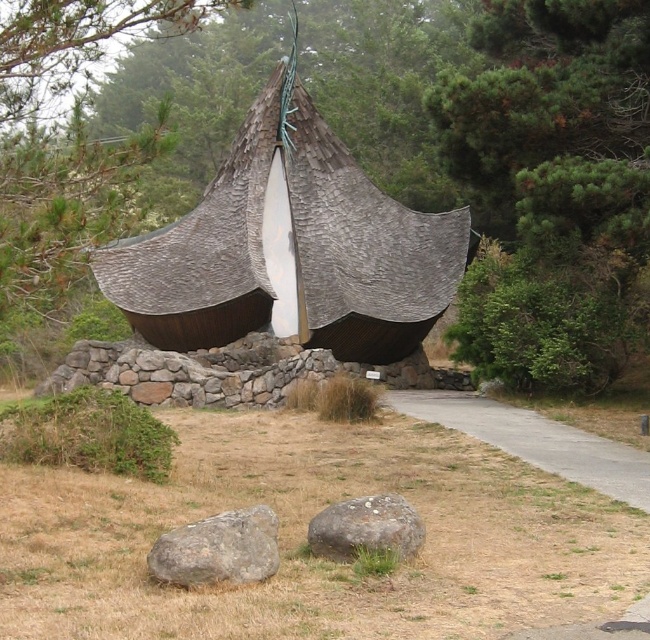
Question: Is gray concrete path at center above gray rough rock at lower left?

Choices:
 (A) yes
 (B) no

Answer: (B)

Question: Which point is closer to the camera?

Choices:
 (A) click(448, 285)
 (B) click(567, 433)
 (C) click(343, 547)
 (D) click(187, 573)

Answer: (D)

Question: Is rustic wood gazebo at center wider than gray concrete path at center?

Choices:
 (A) yes
 (B) no

Answer: (A)

Question: Does rustic wood gazebo at center have a greater width compared to gray rough rock at center?

Choices:
 (A) yes
 (B) no

Answer: (A)

Question: Which is nearer to the gray rough rock at lower left?

Choices:
 (A) gray concrete path at center
 (B) rustic wood gazebo at center
 (C) gray rough rock at center

Answer: (C)

Question: Which point is closer to the camera?

Choices:
 (A) rustic wood gazebo at center
 (B) gray concrete path at center
 (C) gray rough rock at lower left

Answer: (C)